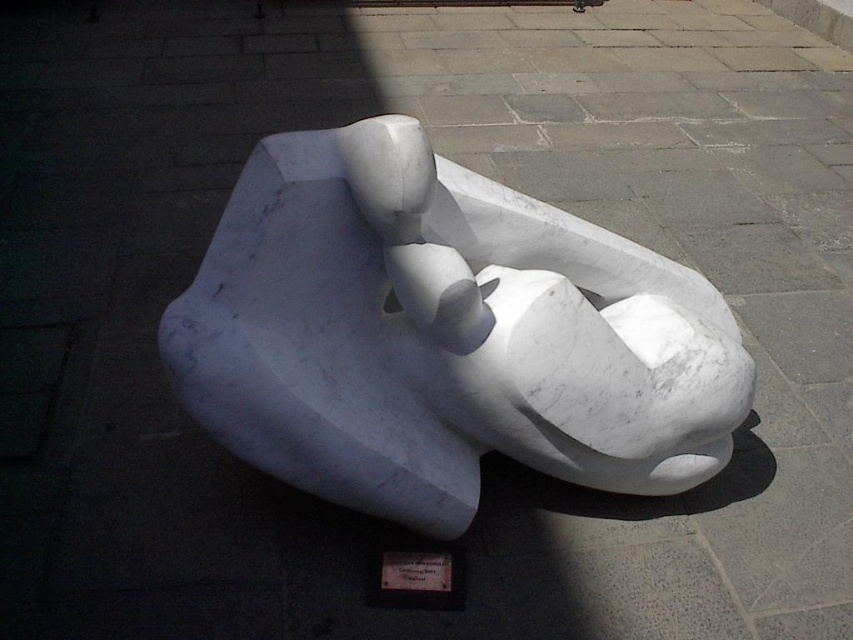
You are a tour guide explaining the sculpture to visitors. You need to mention both the white marble sculpture at center and the wooden plaque at center in your explanation. How far apart are they?

The white marble sculpture at center and the wooden plaque at center are 18.94 inches apart.

You are an art student who wants to create a miniature model of the white marble sculpture at center and the wooden plaque at center. If you want both models to be proportional to each other, which object should you make larger?

The white marble sculpture at center should be made larger in the miniature model since it has a larger size compared to the wooden plaque at center.

You are standing in front of the sculpture and want to know which of the two points, point (372, 296) or point (422, 552), is closer to you. Based on the sculpture details, which point is nearer?

Point (372, 296) is closer to the camera than point (422, 552), so it is the nearer one.